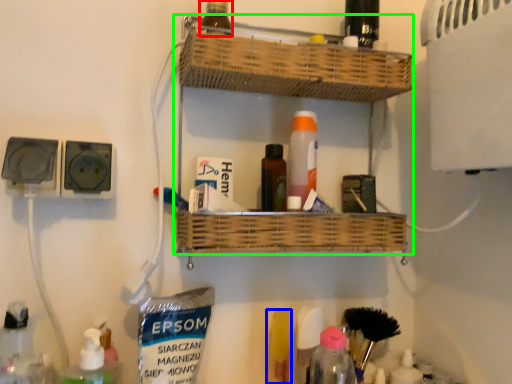
Question: Based on their relative distances, which object is farther from bottle (highlighted by a red box)? Choose from toiletry (highlighted by a blue box) and shelf (highlighted by a green box).

Choices:
 (A) toiletry
 (B) shelf

Answer: (A)